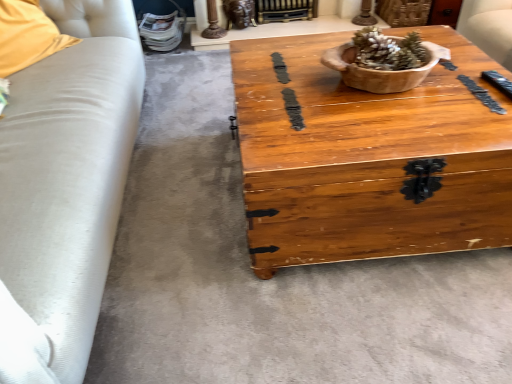
Where is `vacant area that lies in front of wooden bowl at center`? This screenshot has height=384, width=512. vacant area that lies in front of wooden bowl at center is located at coordinates (415, 122).